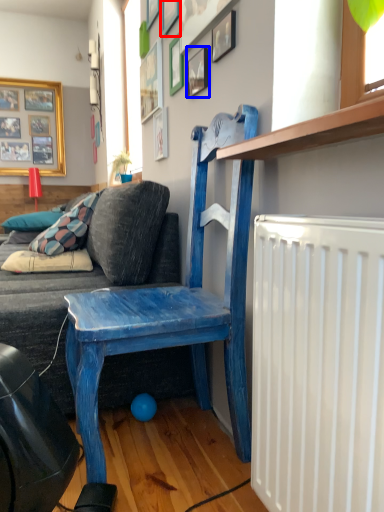
Question: Which point is further to the camera, picture frame (highlighted by a red box) or picture frame (highlighted by a blue box)?

Choices:
 (A) picture frame
 (B) picture frame

Answer: (A)